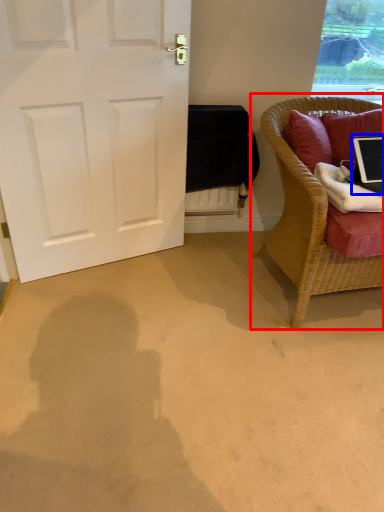
Question: Among these objects, which one is nearest to the camera, chair (highlighted by a red box) or laptop (highlighted by a blue box)?

Choices:
 (A) chair
 (B) laptop

Answer: (A)